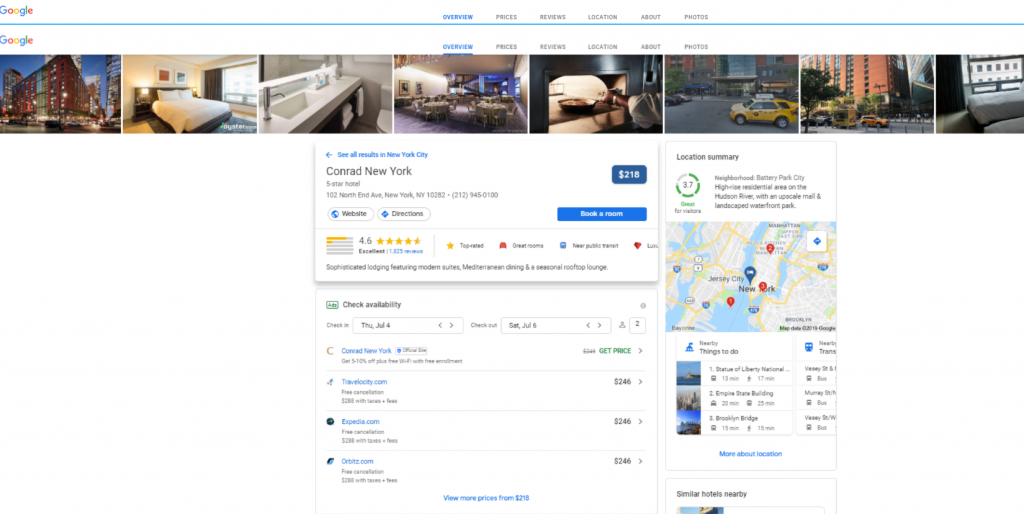
The width and height of the screenshot is (1024, 514). In order to click on pictures in this screenshot , I will do `click(680, 368)`, `click(690, 394)`, `click(682, 425)`.